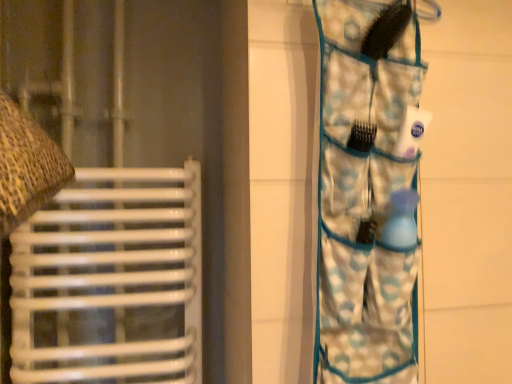
Question: From the image's perspective, is matte brown fabric at left located above or below blue patterned fabric at right?

Choices:
 (A) above
 (B) below

Answer: (A)

Question: In the image, is matte brown fabric at left positioned in front of or behind blue patterned fabric at right?

Choices:
 (A) behind
 (B) front

Answer: (A)

Question: Is point (206, 72) positioned closer to the camera than point (392, 314)?

Choices:
 (A) closer
 (B) farther

Answer: (B)

Question: Relative to matte brown fabric at left, is blue patterned fabric at right in front or behind?

Choices:
 (A) front
 (B) behind

Answer: (A)

Question: From a real-world perspective, is blue patterned fabric at right above or below matte brown fabric at left?

Choices:
 (A) above
 (B) below

Answer: (B)

Question: Considering the positions of blue patterned fabric at right and matte brown fabric at left in the image, is blue patterned fabric at right wider or thinner than matte brown fabric at left?

Choices:
 (A) wide
 (B) thin

Answer: (B)

Question: Is point (392, 360) closer or farther from the camera than point (47, 34)?

Choices:
 (A) farther
 (B) closer

Answer: (B)